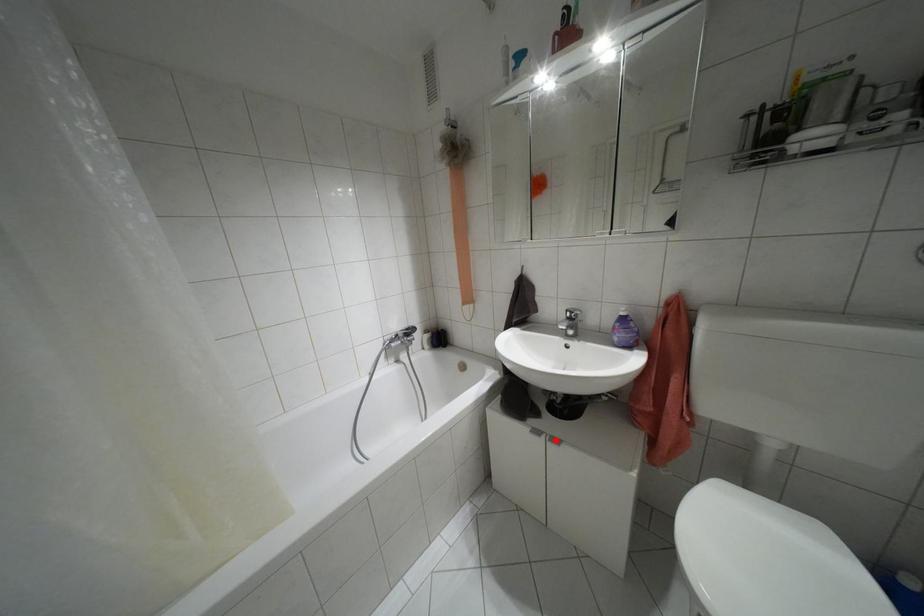
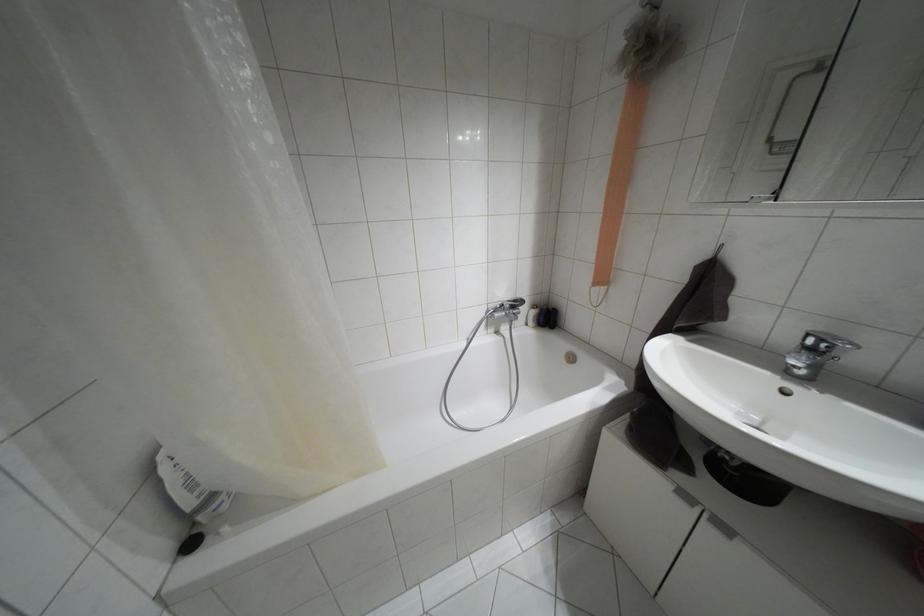
Locate, in the second image, the point that corresponds to the highlighted location in the first image.

(723, 528)